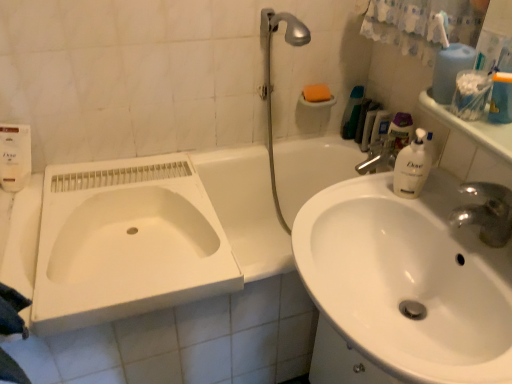
Question: From a real-world perspective, is white plastic container at upper right above or below green matte toothpaste tube at upper right, the 2th toiletry from the right?

Choices:
 (A) above
 (B) below

Answer: (A)

Question: Is white plastic container at upper right inside the boundaries of green matte toothpaste tube at upper right, which appears as the first toiletry when viewed from the left, or outside?

Choices:
 (A) inside
 (B) outside

Answer: (B)

Question: Which of these objects is positioned farthest from the silver metallic shower head at upper right?

Choices:
 (A) white glossy bathtub at center
 (B) white glossy sink at right
 (C) green matte toothpaste tube at upper right, the 2th toiletry from the right
 (D) white plastic bottle at upper right, the second toiletry in the left-to-right sequence
 (E) orange matte soap at upper center

Answer: (B)

Question: Which is farther from the silver metallic shower head at upper right?

Choices:
 (A) white plastic bottle at upper right, placed as the first toiletry when sorted from right to left
 (B) green matte toothpaste tube at upper right, which appears as the first toiletry when viewed from the left
 (C) clear plastic container at upper right, the first mouthwash when ordered from left to right
 (D) orange matte soap at upper center
 (E) clear plastic bottle at upper right, placed as the first mouthwash when sorted from right to left

Answer: (C)